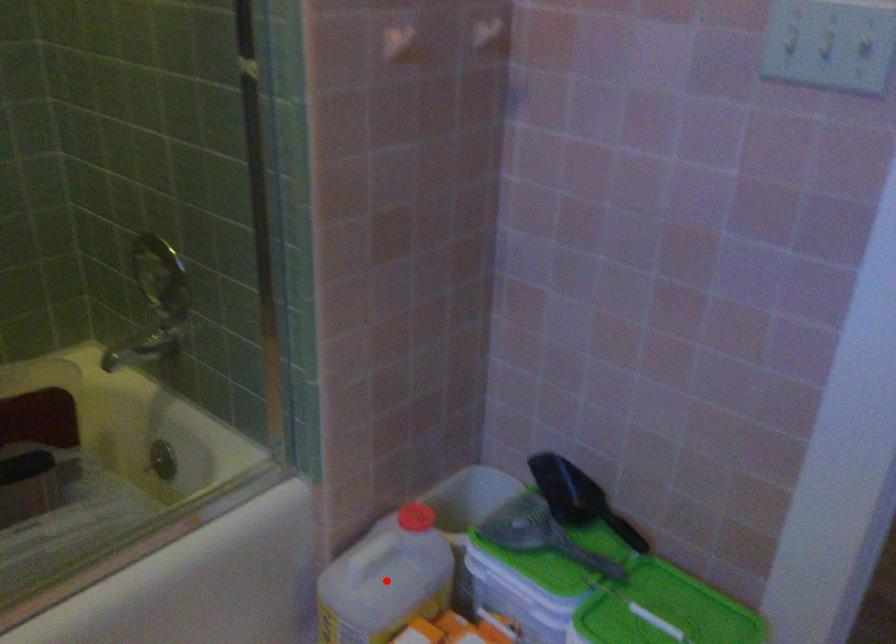
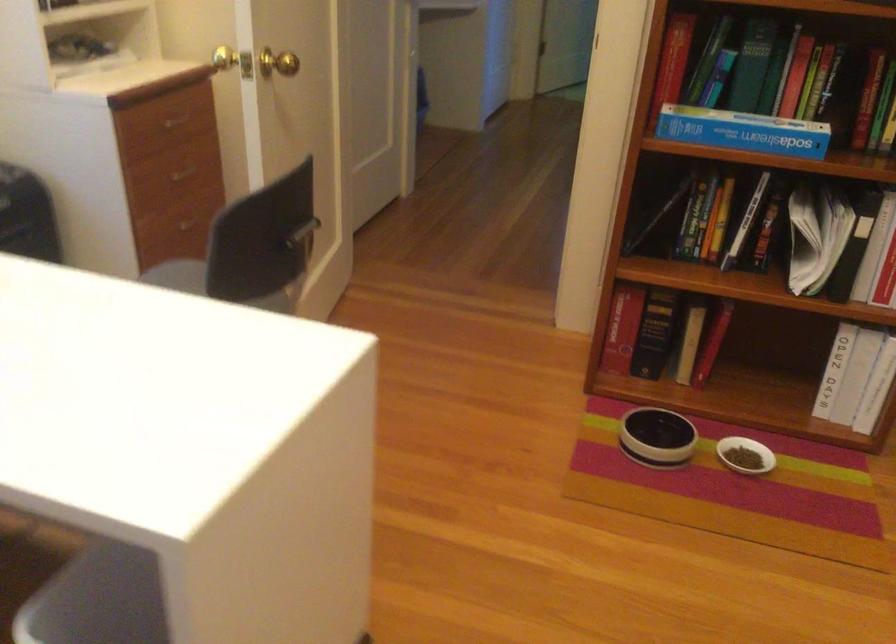
Question: I am providing you with two images of the same scene from different viewpoints. A red point is marked on the first image. Can you still see the location of the red point in image 2?

Choices:
 (A) Yes
 (B) No

Answer: (B)